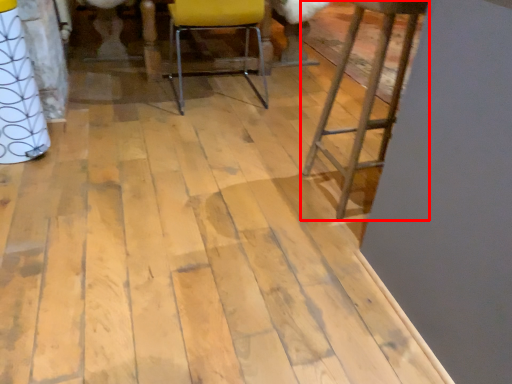
Question: From the image, what is the correct spatial relationship of furniture (annotated by the red box) in relation to chair?

Choices:
 (A) right
 (B) left

Answer: (A)